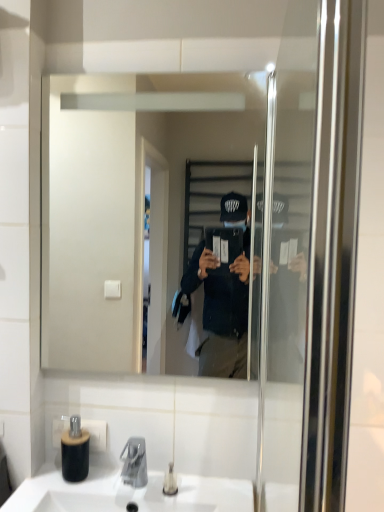
From the picture: In order to face black matte bottle at lower left, should I rotate leftwards or rightwards?

Rotate your view left by about 15.514°.

Describe the element at coordinates (127, 493) in the screenshot. This screenshot has width=384, height=512. I see `white ceramic sink at lower center` at that location.

The height and width of the screenshot is (512, 384). I want to click on black matte bottle at lower left, so click(75, 451).

Considering the relative positions of clear glass mirror at center and black matte bottle at lower left in the image provided, is clear glass mirror at center to the right of black matte bottle at lower left from the viewer's perspective?

Yes.

Considering the relative sizes of clear glass mirror at center and black matte bottle at lower left in the image provided, is clear glass mirror at center bigger than black matte bottle at lower left?

Indeed, clear glass mirror at center has a larger size compared to black matte bottle at lower left.

Is black matte bottle at lower left at the back of clear glass mirror at center?

clear glass mirror at center does not have its back to black matte bottle at lower left.

From the image's perspective, relative to black matte bottle at lower left, is clear glass mirror at center above or below?

Based on their image positions, clear glass mirror at center is located above black matte bottle at lower left.

Does black matte bottle at lower left have a lesser height compared to white ceramic sink at lower center?

No.

Is black matte bottle at lower left in front of or behind white ceramic sink at lower center in the image?

Clearly, black matte bottle at lower left is behind white ceramic sink at lower center.

Does black matte bottle at lower left contain white ceramic sink at lower center?

No.

Who is bigger, black matte bottle at lower left or white ceramic sink at lower center?

white ceramic sink at lower center.

Between clear glass mirror at center and white ceramic sink at lower center, which one appears on the left side from the viewer's perspective?

From the viewer's perspective, white ceramic sink at lower center appears more on the left side.

At what (x,y) coordinates should I click in order to perform the action: click on mirror behind the white ceramic sink at lower center. Please return your answer as a coordinate pair (x, y). Looking at the image, I should click on (128, 208).

Is clear glass mirror at center far away from white ceramic sink at lower center?

No.

At what (x,y) coordinates should I click in order to perform the action: click on toiletry on the right of white ceramic sink at lower center. Please return your answer as a coordinate pair (x, y). Image resolution: width=384 pixels, height=512 pixels. Looking at the image, I should click on (170, 481).

Does clear plastic bottle at lower center have a smaller size compared to white ceramic sink at lower center?

Correct, clear plastic bottle at lower center occupies less space than white ceramic sink at lower center.

Between clear plastic bottle at lower center and white ceramic sink at lower center, which one has larger width?

With larger width is white ceramic sink at lower center.

Which object is positioned more to the right, black matte bottle at lower left or clear plastic bottle at lower center?

clear plastic bottle at lower center.

Is the depth of black matte bottle at lower left greater than that of clear plastic bottle at lower center?

Yes, it is.

From a real-world perspective, relative to clear plastic bottle at lower center, is black matte bottle at lower left vertically above or below?

black matte bottle at lower left is situated higher than clear plastic bottle at lower center in the real world.

Consider the image. Which of these two, black matte bottle at lower left or clear plastic bottle at lower center, is thinner?

clear plastic bottle at lower center is thinner.

Based on the photo, can you confirm if white ceramic sink at lower center is positioned to the left of clear glass mirror at center?

Yes.

Is white ceramic sink at lower center in front of or behind clear glass mirror at center in the image?

white ceramic sink at lower center is positioned closer to the viewer than clear glass mirror at center.

From a real-world perspective, between white ceramic sink at lower center and clear glass mirror at center, who is vertically higher?

clear glass mirror at center.

In terms of width, does white ceramic sink at lower center look wider or thinner when compared to clear glass mirror at center?

Clearly, white ceramic sink at lower center has more width compared to clear glass mirror at center.

Is white ceramic sink at lower center oriented away from black matte bottle at lower left?

No, black matte bottle at lower left is not at the back of white ceramic sink at lower center.

How different are the orientations of white ceramic sink at lower center and black matte bottle at lower left in degrees?

The angular difference between white ceramic sink at lower center and black matte bottle at lower left is 3.9e-05 degrees.

Which of these two, white ceramic sink at lower center or black matte bottle at lower left, stands shorter?

Standing shorter between the two is white ceramic sink at lower center.

Image resolution: width=384 pixels, height=512 pixels. What are the coordinates of `mirror above the black matte bottle at lower left (from the image's perspective)` in the screenshot? It's located at (128, 208).

The width and height of the screenshot is (384, 512). What are the coordinates of `sink that appears on the right of black matte bottle at lower left` in the screenshot? It's located at (127, 493).

When comparing their distances from white ceramic sink at lower center, does black matte bottle at lower left or clear glass mirror at center seem closer?

Based on the image, black matte bottle at lower left appears to be nearer to white ceramic sink at lower center.

Estimate the real-world distances between objects in this image. Which object is further from black matte bottle at lower left, white ceramic sink at lower center or clear glass mirror at center?

Among the two, clear glass mirror at center is located further to black matte bottle at lower left.

Looking at the image, which one is located further to black matte bottle at lower left, clear glass mirror at center or white ceramic sink at lower center?

Among the two, clear glass mirror at center is located further to black matte bottle at lower left.

Considering their positions, is clear plastic bottle at lower center positioned further to black matte bottle at lower left than clear glass mirror at center?

The object further to black matte bottle at lower left is clear glass mirror at center.

When comparing their distances from black matte bottle at lower left, does clear glass mirror at center or clear plastic bottle at lower center seem closer?

The object closer to black matte bottle at lower left is clear plastic bottle at lower center.

Looking at the image, which one is located closer to clear plastic bottle at lower center, black matte bottle at lower left or clear glass mirror at center?

The object closer to clear plastic bottle at lower center is black matte bottle at lower left.

Considering their positions, is clear plastic bottle at lower center positioned closer to black matte bottle at lower left than white ceramic sink at lower center?

white ceramic sink at lower center lies closer to black matte bottle at lower left than the other object.

From the picture: Based on their spatial positions, is clear plastic bottle at lower center or white ceramic sink at lower center further from clear glass mirror at center?

clear plastic bottle at lower center lies further to clear glass mirror at center than the other object.

I want to click on sink situated between black matte bottle at lower left and clear plastic bottle at lower center from left to right, so click(x=127, y=493).

At what (x,y) coordinates should I click in order to perform the action: click on bottle between clear glass mirror at center and clear plastic bottle at lower center in the vertical direction. Please return your answer as a coordinate pair (x, y). Looking at the image, I should click on (75, 451).

This screenshot has width=384, height=512. I want to click on bottle between clear glass mirror at center and white ceramic sink at lower center in the vertical direction, so click(75, 451).

Image resolution: width=384 pixels, height=512 pixels. Identify the location of toiletry between clear glass mirror at center and white ceramic sink at lower center in the vertical direction. (170, 481).